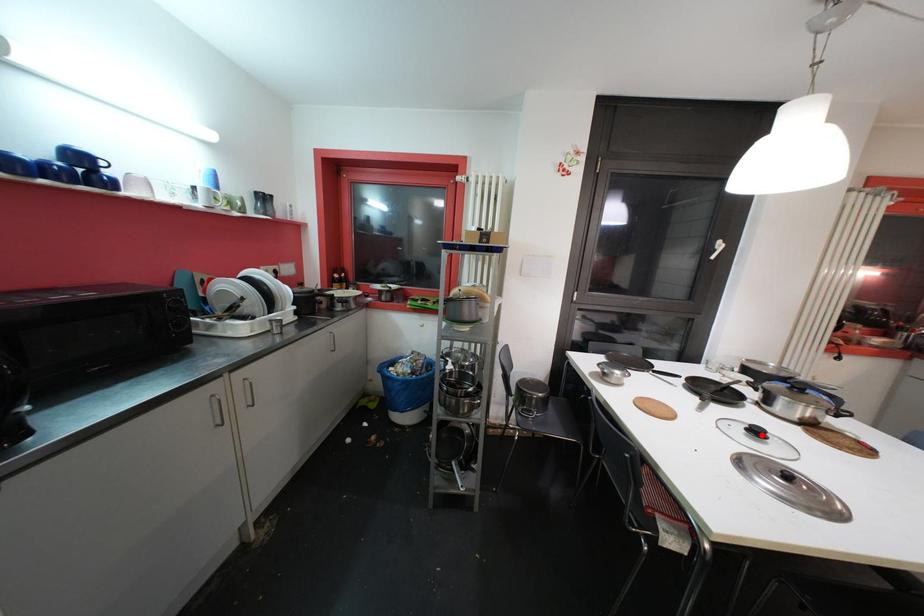
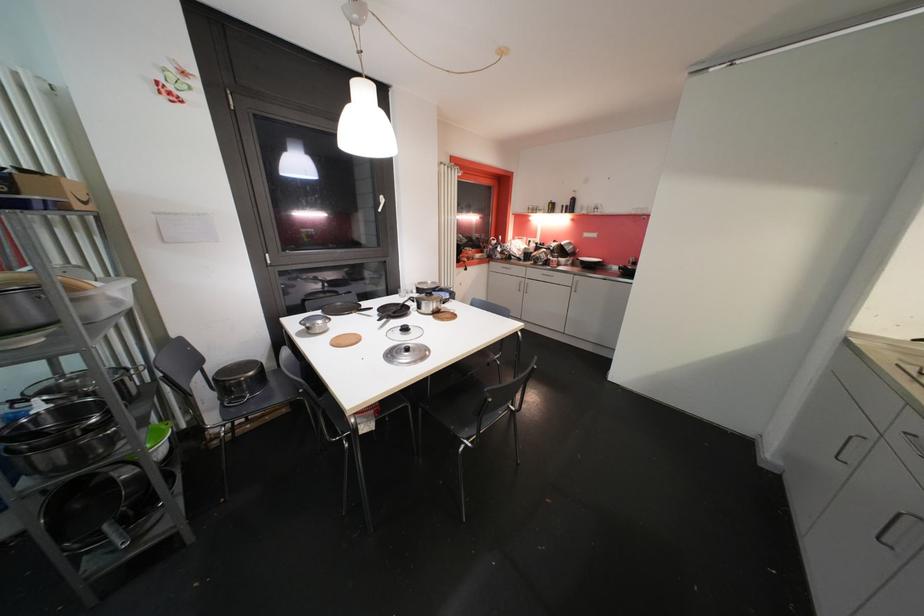
Where in the second image is the point corresponding to the highlighted location from the first image?

(409, 331)